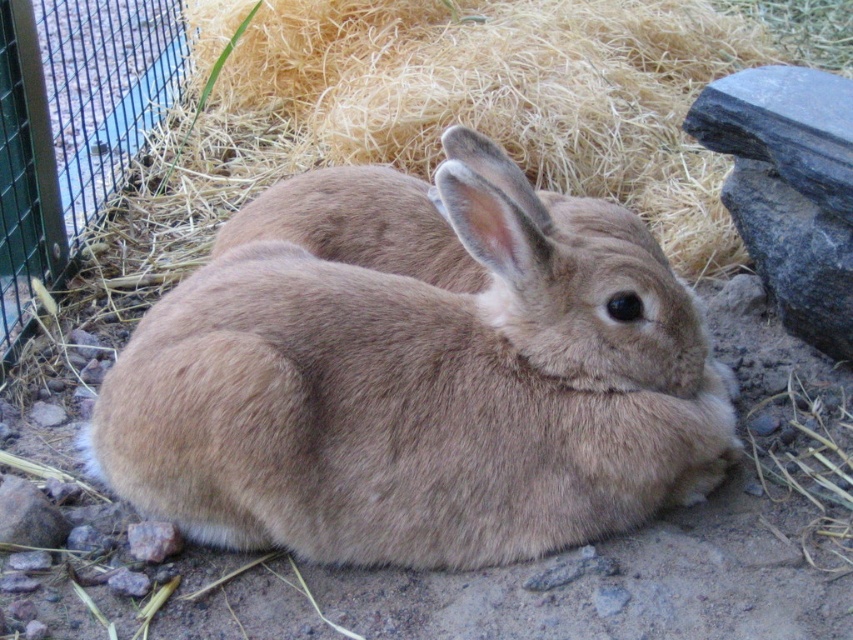
Consider the image. Between fuzzy brown rabbit at center and brown soft hay at center, which one appears on the left side from the viewer's perspective?

fuzzy brown rabbit at center

Who is more distant from viewer, (575, 474) or (318, 44)?

Positioned behind is point (318, 44).

Measure the distance between point (572,454) and camera.

They are 5.30 feet apart.

Locate an element on the screen. The width and height of the screenshot is (853, 640). fuzzy brown rabbit at center is located at coordinates (418, 394).